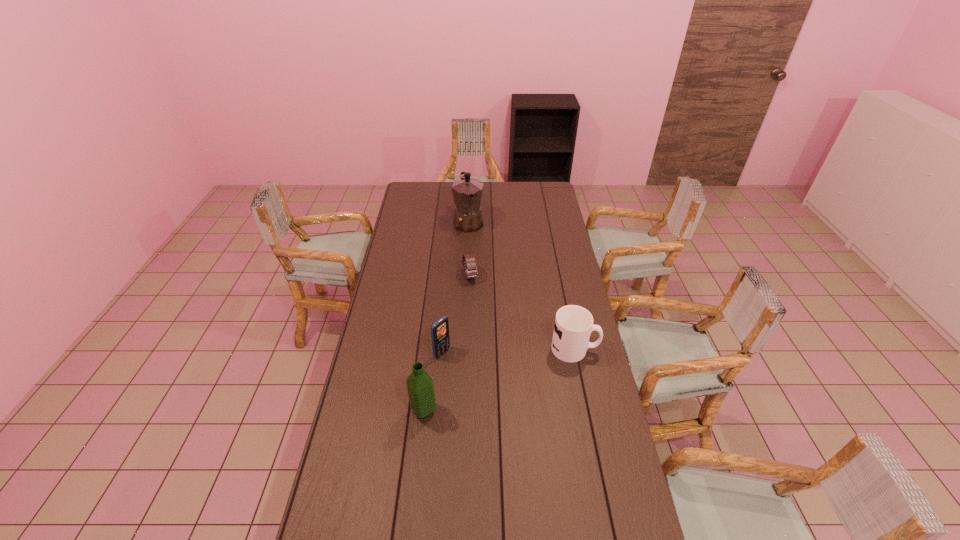
What are the coordinates of `the nearest object` in the screenshot? It's located at (420, 386).

This screenshot has height=540, width=960. Identify the location of water bottle. (420, 386).

This screenshot has width=960, height=540. I want to click on mug, so click(x=573, y=325).

Locate an element on the screen. This screenshot has width=960, height=540. coffeepot is located at coordinates tap(467, 192).

You are a GUI agent. You are given a task and a screenshot of the screen. Output one action in this format:
    pyautogui.click(x=<x>, y=<y>)
    Task: Click on the tallest object
    The height and width of the screenshot is (540, 960).
    Given the screenshot: What is the action you would take?
    pyautogui.click(x=467, y=192)

You are a GUI agent. You are given a task and a screenshot of the screen. Output one action in this format:
    pyautogui.click(x=<x>, y=<y>)
    Task: Click on the cellular telephone
    This screenshot has height=540, width=960.
    Given the screenshot: What is the action you would take?
    pyautogui.click(x=440, y=329)

I want to click on the shortest object, so click(468, 259).

Find the location of a particular element. This screenshot has width=960, height=540. the second farthest object is located at coordinates (468, 259).

At what (x,y) coordinates should I click in order to perform the action: click on vacant point located 0.310m on the front of the water bottle. Please return your answer as a coordinate pair (x, y). The height and width of the screenshot is (540, 960). Looking at the image, I should click on (412, 519).

The height and width of the screenshot is (540, 960). I want to click on free location located on the pouring side of the farthest object, so click(477, 252).